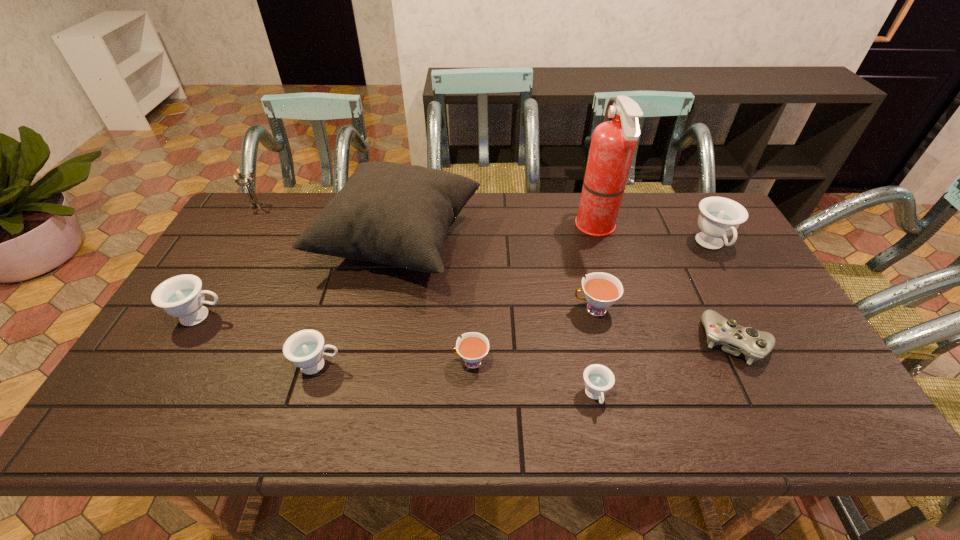
The height and width of the screenshot is (540, 960). I want to click on control located at the right edge, so pyautogui.click(x=755, y=345).

The height and width of the screenshot is (540, 960). What are the coordinates of `object that is positioned at the far left corner` in the screenshot? It's located at (254, 201).

Locate an element on the screen. This screenshot has height=540, width=960. object that is at the far right corner is located at coordinates (719, 217).

In the image, there is a desktop. At what (x,y) coordinates should I click in order to perform the action: click on vacant space at the far edge. Please return your answer as a coordinate pair (x, y). Looking at the image, I should click on (547, 217).

The width and height of the screenshot is (960, 540). Find the location of `vacant space at the near edge of the desktop`. vacant space at the near edge of the desktop is located at coordinates (447, 422).

Where is `free point at the left edge`? free point at the left edge is located at coordinates (196, 335).

Where is `vacant position at the far left corner of the desktop`? This screenshot has width=960, height=540. vacant position at the far left corner of the desktop is located at coordinates (260, 201).

In the image, there is a desktop. What are the coordinates of `free space at the near right corner` in the screenshot? It's located at (796, 408).

Find the location of a particular element. The width and height of the screenshot is (960, 540). vacant space in between the second teacup from left to right and the control is located at coordinates tap(526, 353).

Locate an element on the screen. Image resolution: width=960 pixels, height=540 pixels. free area in between the leftmost blue teacup and the control is located at coordinates (468, 329).